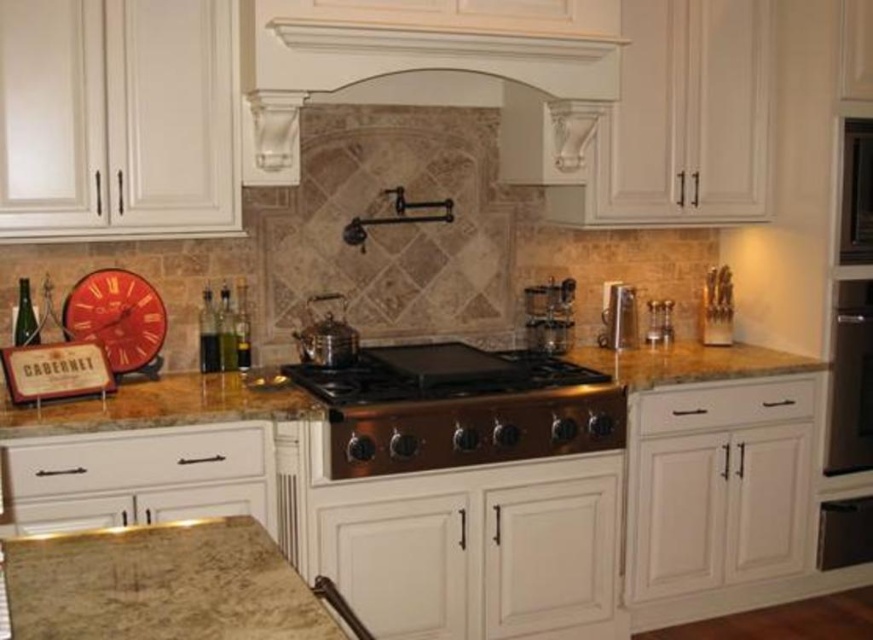
You are a kitchen designer and need to install a new microwave that requires a space wider than the white marble exhaust hood at upper center. Can the satin nickel oven at right provide enough space for the microwave?

The white marble exhaust hood at upper center is wider than the satin nickel oven at right. Since the microwave needs a space wider than the exhaust hood, the satin nickel oven at right cannot provide sufficient space.

You are standing in the kitchen and want to reach both points mentioned. Which point is closer to you, point [275,163] or point [837,362]?

Point [275,163] is closer to the camera than point [837,362], so you can reach it first.

You are a chef preparing a dish and need to choose between using the marble countertop at lower left or the satin nickel faucet at center for placing your ingredients. Which surface has more space to accommodate your ingredients?

The marble countertop at lower left is larger in size than the satin nickel faucet at center, so it has more space to accommodate ingredients.